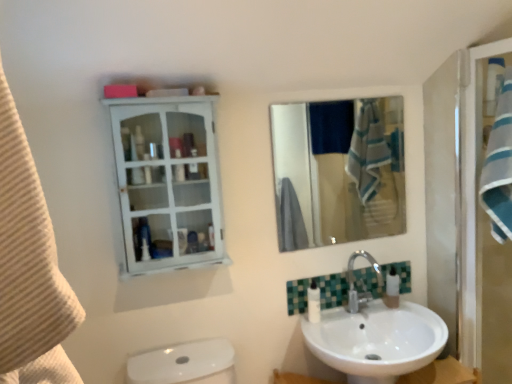
Question: Considering the positions of polished chrome faucet at lower center and white glossy cabinet at upper left in the image, is polished chrome faucet at lower center wider or thinner than white glossy cabinet at upper left?

Choices:
 (A) wide
 (B) thin

Answer: (A)

Question: Considering the relative positions of polished chrome faucet at lower center and white glossy cabinet at upper left in the image provided, is polished chrome faucet at lower center to the left or to the right of white glossy cabinet at upper left?

Choices:
 (A) left
 (B) right

Answer: (B)

Question: Which object is positioned closest to the white glossy lotion at lower center?

Choices:
 (A) white plastic soap dispenser at lower right
 (B) polished chrome faucet at lower center
 (C) white glossy cabinet at upper left
 (D) blue striped towel at right
 (E) beige textured towel at left

Answer: (B)

Question: Which is nearer to the polished chrome faucet at lower center?

Choices:
 (A) white glossy lotion at lower center
 (B) white plastic soap dispenser at lower right
 (C) white glossy cabinet at upper left
 (D) blue striped towel at right
 (E) beige textured towel at left

Answer: (B)